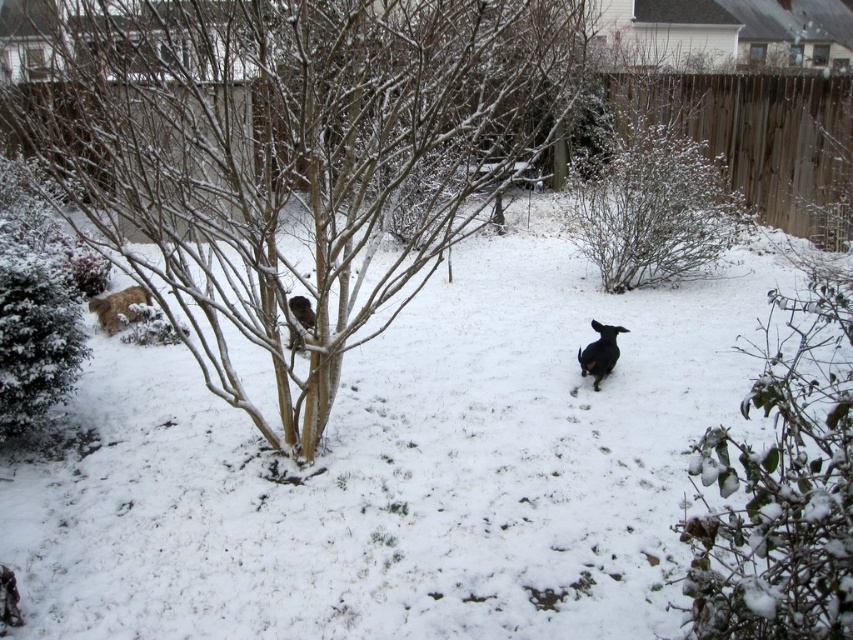
Does point (613, 490) lie behind point (396, 312)?

That is False.

Which is more to the right, white fluffy snow at center or snow-covered branches at center?

white fluffy snow at center

Between point (131, 513) and point (302, 122), which one is positioned behind?

The point (131, 513) is behind.

This screenshot has width=853, height=640. Find the location of `white fluffy snow at center`. white fluffy snow at center is located at coordinates (402, 470).

Does point (561, 346) come farther from viewer compared to point (33, 234)?

No, (561, 346) is closer to viewer.

Measure the distance between point (148, 531) and camera.

The distance of point (148, 531) from camera is 13.57 feet.

The width and height of the screenshot is (853, 640). In order to click on white fluffy snow at center in this screenshot , I will do `click(402, 470)`.

From the picture: Who is taller, snow-covered branches at center or green matte bush at left?

Standing taller between the two is green matte bush at left.

Is snow-covered branches at center below green matte bush at left?

Yes, snow-covered branches at center is below green matte bush at left.

You are a GUI agent. You are given a task and a screenshot of the screen. Output one action in this format:
    pyautogui.click(x=<x>, y=<y>)
    Task: Click on the snow-covered branches at center
    
    Given the screenshot: What is the action you would take?
    pyautogui.click(x=292, y=154)

Locate an element on the screen. The height and width of the screenshot is (640, 853). snow-covered branches at center is located at coordinates (292, 154).